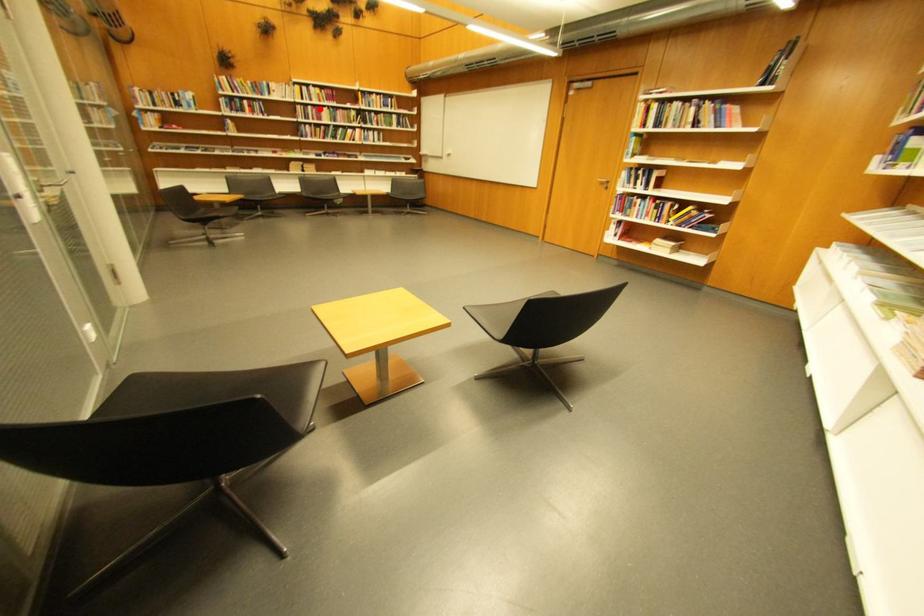
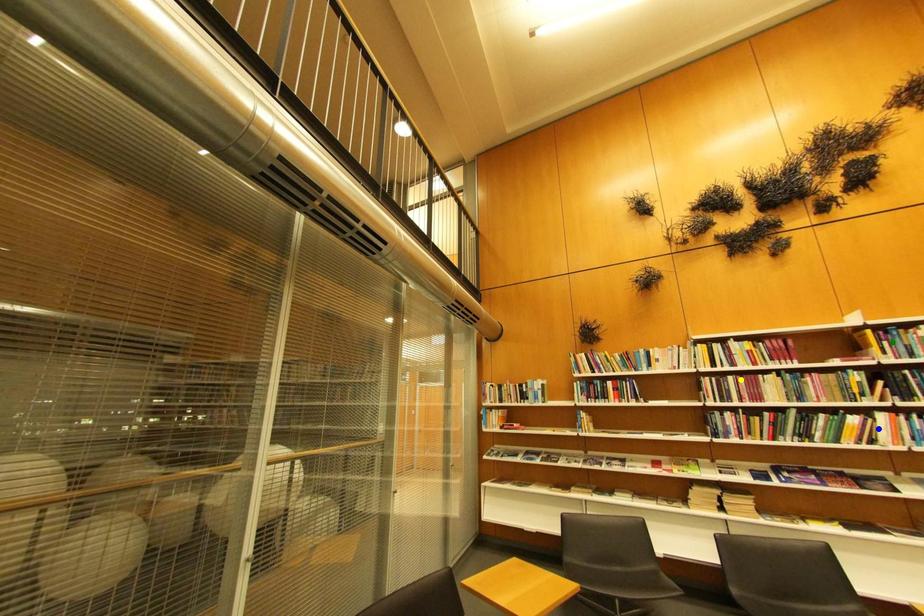
Question: I am providing you with two images of the same scene from different viewpoints. A red point is marked on the first image. You are given multiple points on the second image. Which point in image 2 represents the same 3d spot as the red point in image 1?

Choices:
 (A) blue point
 (B) yellow point
 (C) green point

Answer: (B)